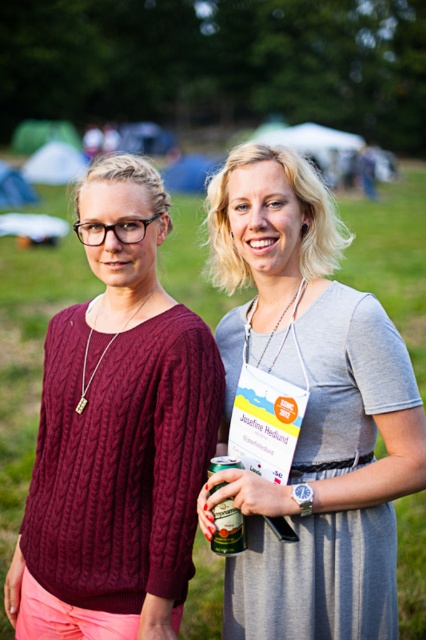
Consider the image. You are organizing a photo shoot and need to ensure that the green matte can at center is visible in the final image. Given that the gray cotton dress at center is currently blocking it, how can you adjust the subjects to achieve this?

Move the gray cotton dress at center to the side so that it is no longer positioned over the green matte can at center.

You are standing in the middle of the image and want to hand a gift to the person wearing the gray cotton dress at center. In which direction should you move to reach them?

The gray cotton dress at center is located at coordinates point (310, 410), so you should move to the right and slightly downward to reach them.